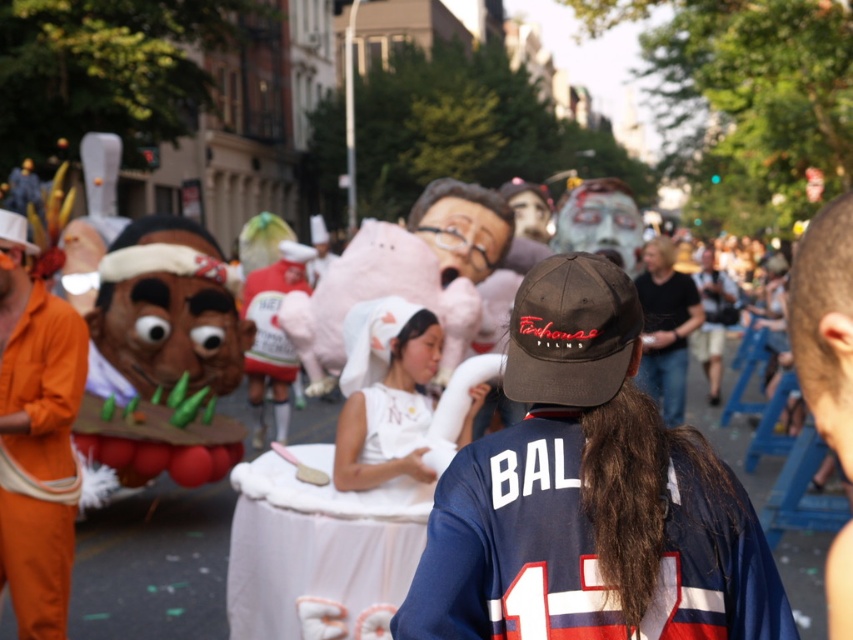
Question: Which point is farther to the camera?

Choices:
 (A) brown fabric baseball cap at center
 (B) blue jersey at center

Answer: (A)

Question: Which point is closer to the camera?

Choices:
 (A) matte brown statue at center
 (B) black cotton shirt at center
 (C) blue jersey at center
 (D) orange fabric costume at left

Answer: (C)

Question: Is matte brown statue at center positioned in front of brown fabric baseball cap at center?

Choices:
 (A) no
 (B) yes

Answer: (A)

Question: Which object is farther from the camera taking this photo?

Choices:
 (A) blue jersey at center
 (B) pink cotton candy at center
 (C) orange fabric costume at left
 (D) matte pink plush at center

Answer: (B)

Question: Can you confirm if brown fabric baseball cap at center is bigger than pink cotton candy at center?

Choices:
 (A) yes
 (B) no

Answer: (B)

Question: Is matte brown statue at center thinner than pink cotton candy at center?

Choices:
 (A) no
 (B) yes

Answer: (A)